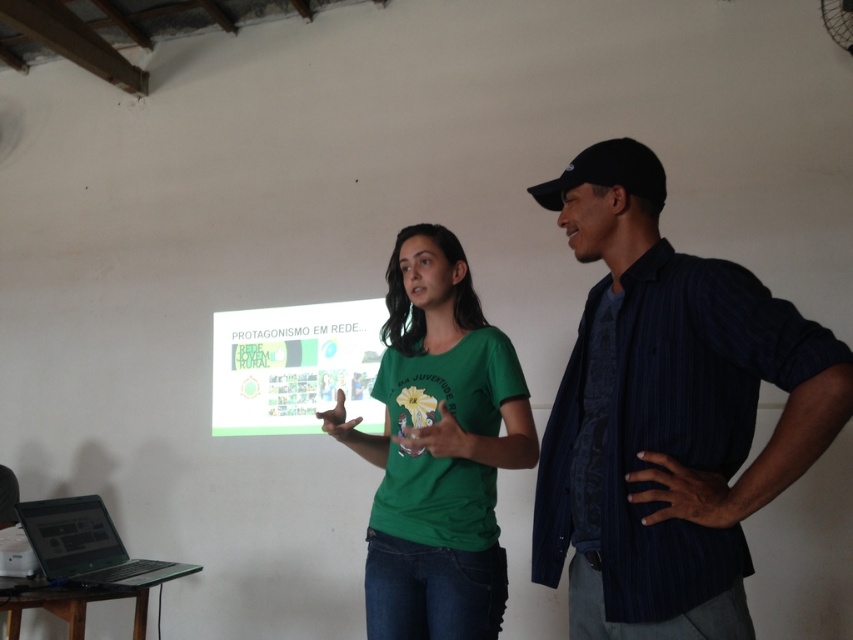
Question: Which point is farther to the camera?

Choices:
 (A) (672, 564)
 (B) (134, 557)

Answer: (B)

Question: Which of the following is the closest to the observer?

Choices:
 (A) dark blue striped shirt at center
 (B) matte green screen at center
 (C) green matte t-shirt at center
 (D) black glossy laptop at lower left

Answer: (A)

Question: In this image, where is dark blue striped shirt at center located relative to black plastic projector at lower left?

Choices:
 (A) above
 (B) below

Answer: (A)

Question: Does black glossy laptop at lower left have a larger size compared to black plastic projector at lower left?

Choices:
 (A) no
 (B) yes

Answer: (B)

Question: Which of these objects is positioned closest to the matte green screen at center?

Choices:
 (A) green matte t-shirt at center
 (B) black glossy laptop at lower left
 (C) black plastic projector at lower left

Answer: (B)

Question: Is the position of matte green screen at center more distant than that of black plastic projector at lower left?

Choices:
 (A) yes
 (B) no

Answer: (A)